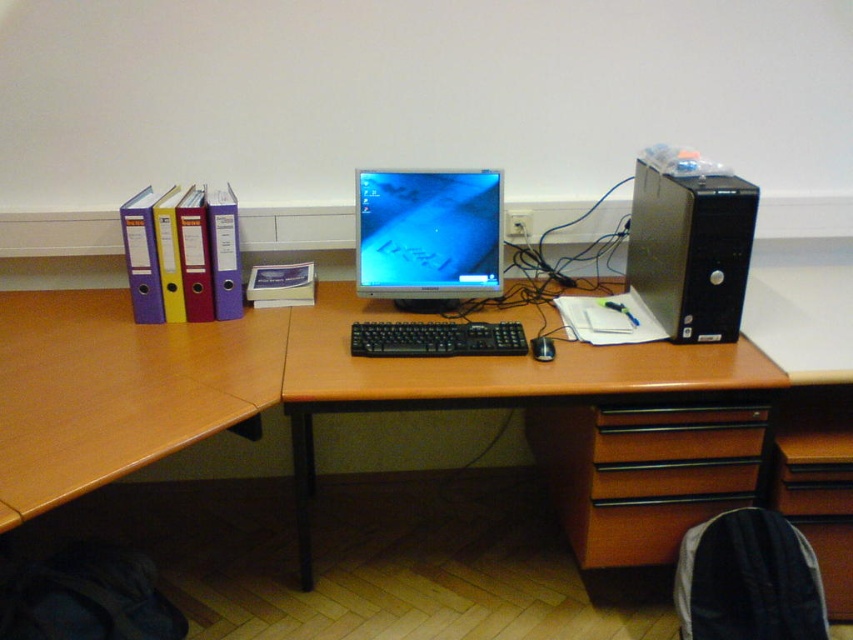
You are sitting at the brown wood computer desk at center and want to reach the black plastic keyboard at center. Is the keyboard within easy reach from your seated position?

The brown wood computer desk at center is in front of the black plastic keyboard at center, so the keyboard is likely within easy reach from your seated position as it is positioned directly in front of you.

You are organizing your desk and want to place a new wireless charger between the brown wood computer desk at center and the black plastic mouse at center. Based on their positions, where should you place the wireless charger?

The brown wood computer desk at center is located below the black plastic mouse at center. Therefore, you should place the wireless charger above the desk but below the mouse to position it between them.

You are setting up a new monitor on your desk and want to ensure it sits at eye level. Given the brown wood computer desk at center and the black plastic mouse at center, which object is taller and should the monitor be adjusted upwards or downwards to reach eye level?

The brown wood computer desk at center is taller than the black plastic mouse at center. Since the desk is taller, the monitor should be adjusted upwards to reach eye level.